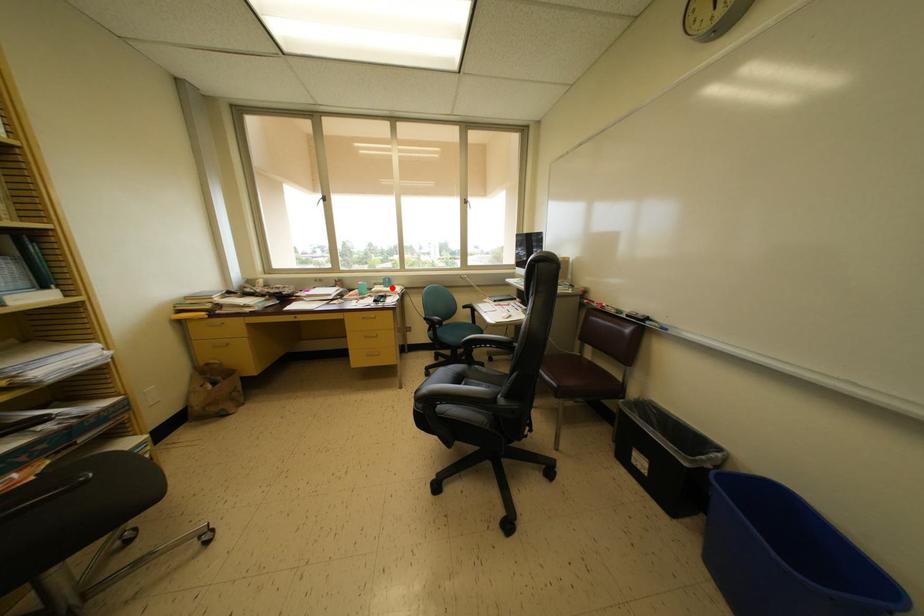
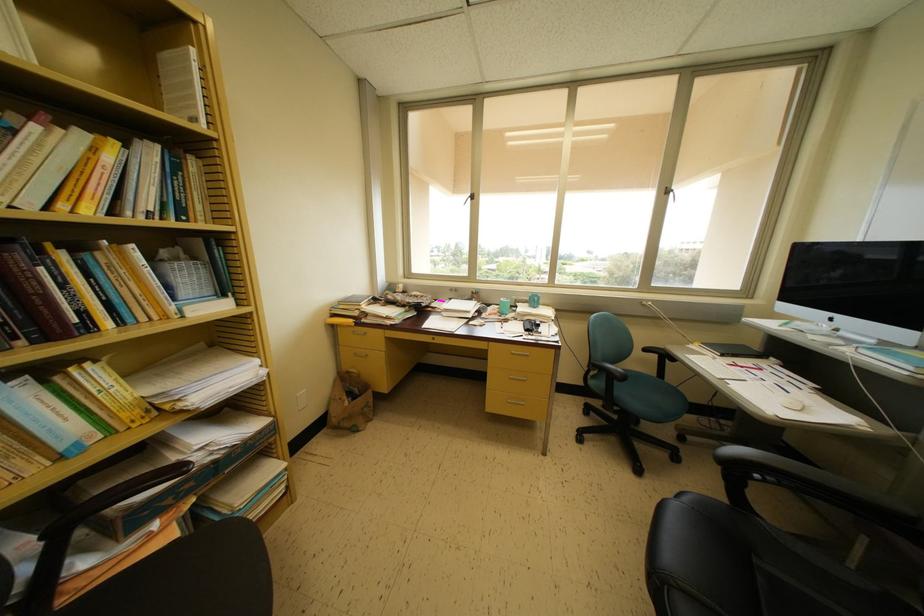
Where in the second image is the point corresponding to the highlighted location from the first image?

(538, 306)